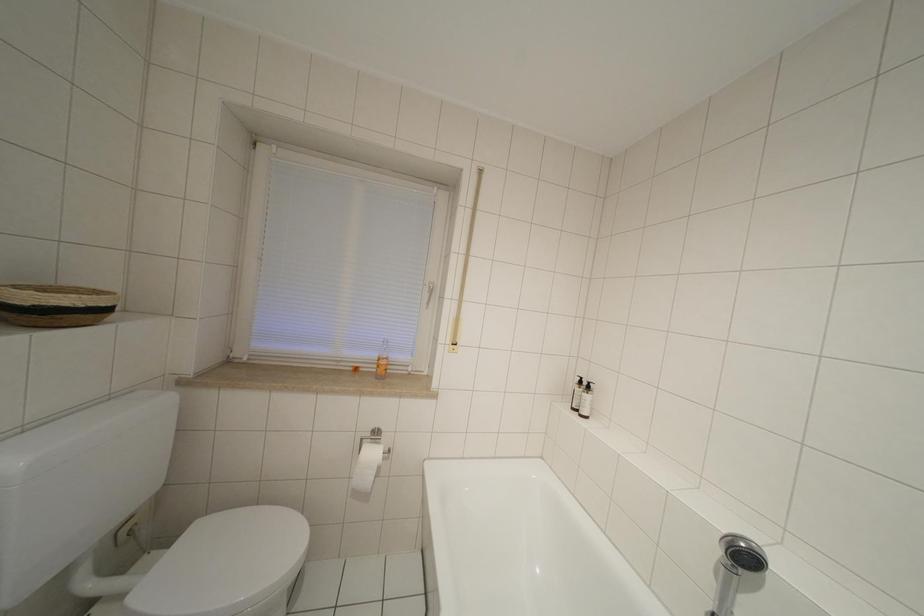
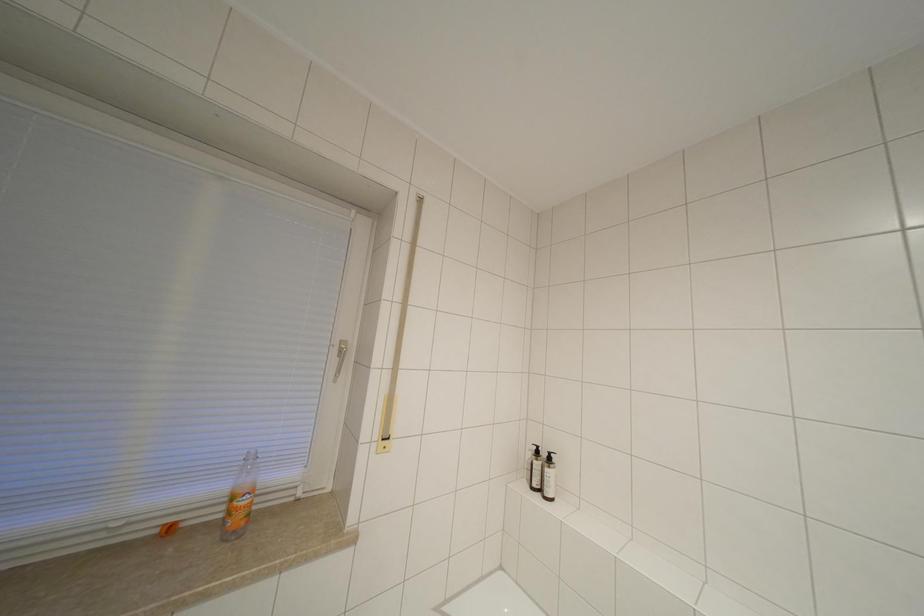
Question: Based on the continuous images, in which direction is the camera rotating? Reply with the corresponding letter.

Choices:
 (A) Left
 (B) Right
 (C) Up
 (D) Down

Answer: (B)